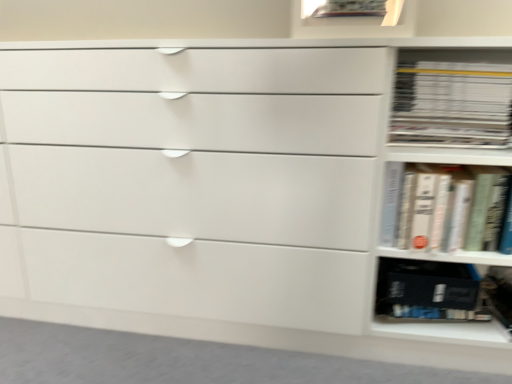
Question: Based on their sizes in the image, would you say white glossy book at right, which is the 2th book from bottom to top, is bigger or smaller than white matte book at right, placed as the 2th book when sorted from top to bottom?

Choices:
 (A) small
 (B) big

Answer: (A)

Question: From the image's perspective, relative to white matte book at right, acting as the first book starting from the bottom, is white glossy book at right, which is the 2th book from bottom to top, above or below?

Choices:
 (A) above
 (B) below

Answer: (A)

Question: Considering the real-world distances, which object is closest to the white matte book at right, placed as the 2th book when sorted from top to bottom?

Choices:
 (A) black matte book at lower right
 (B) white glossy book at right, which is the 2th book from bottom to top

Answer: (B)

Question: Estimate the real-world distances between objects in this image. Which object is farther from the white glossy book at right, which is counted as the first book, starting from the top?

Choices:
 (A) white matte book at right, placed as the 2th book when sorted from top to bottom
 (B) black matte book at lower right

Answer: (B)